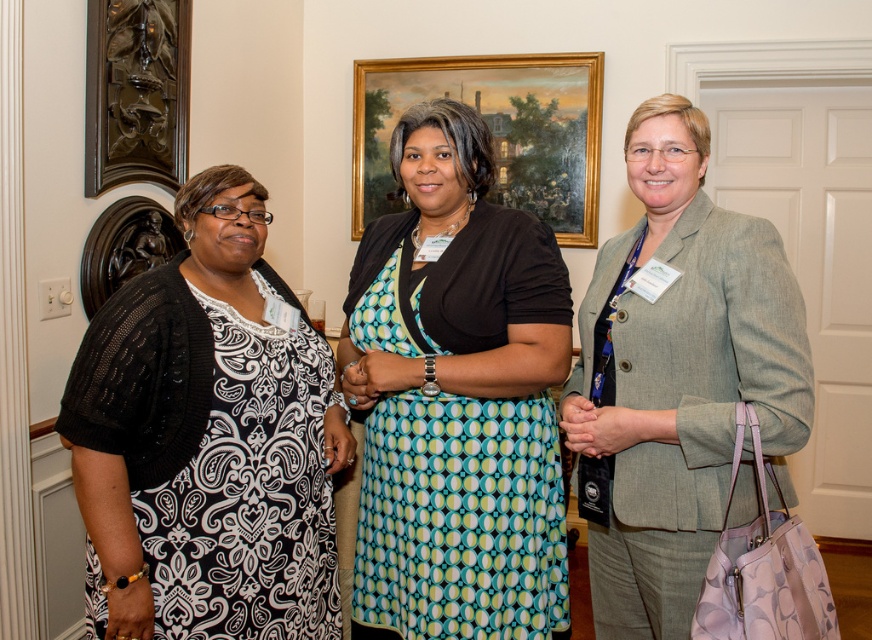
Between gold-framed painting at center and dark brown carved wood at upper left, which one appears on the left side from the viewer's perspective?

Positioned to the left is dark brown carved wood at upper left.

Does gold-framed painting at center appear under dark brown carved wood at upper left?

Incorrect, gold-framed painting at center is not positioned below dark brown carved wood at upper left.

Where is `gold-framed painting at center`? gold-framed painting at center is located at coordinates (494, 131).

Between teal dotted dress at center and black knit cardigan at left, which one is positioned lower?

black knit cardigan at left is below.

Can you confirm if teal dotted dress at center is positioned to the right of black knit cardigan at left?

Yes, teal dotted dress at center is to the right of black knit cardigan at left.

Who is more forward, (546, 403) or (230, 474)?

Positioned in front is point (230, 474).

I want to click on teal dotted dress at center, so click(x=455, y=397).

Is teal dotted dress at center wider than dark brown carved wood at upper left?

Yes.

Based on the photo, can you confirm if teal dotted dress at center is smaller than dark brown carved wood at upper left?

Actually, teal dotted dress at center might be larger than dark brown carved wood at upper left.

Does point (516, 372) come closer to viewer compared to point (101, 60)?

Yes.

Where is `teal dotted dress at center`? Image resolution: width=872 pixels, height=640 pixels. teal dotted dress at center is located at coordinates (455, 397).